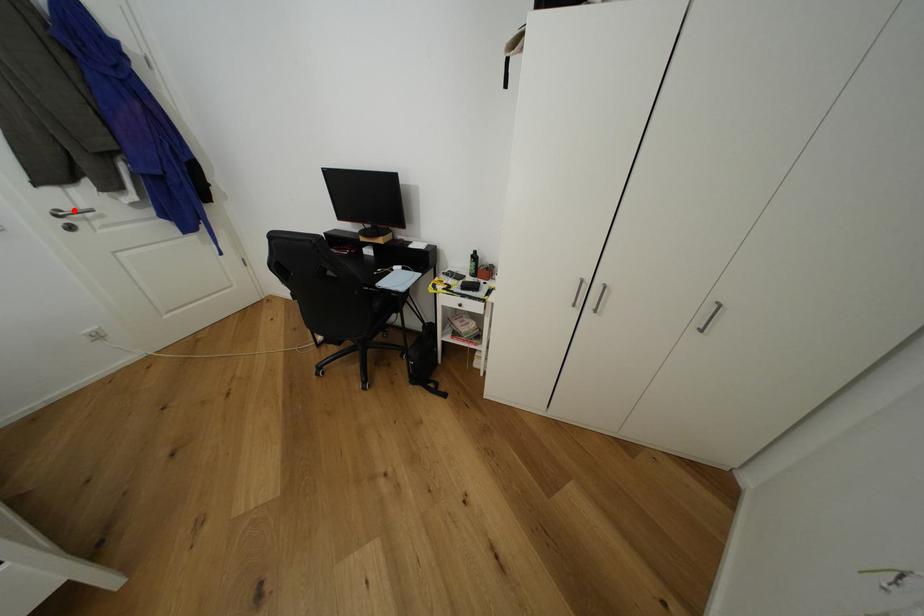
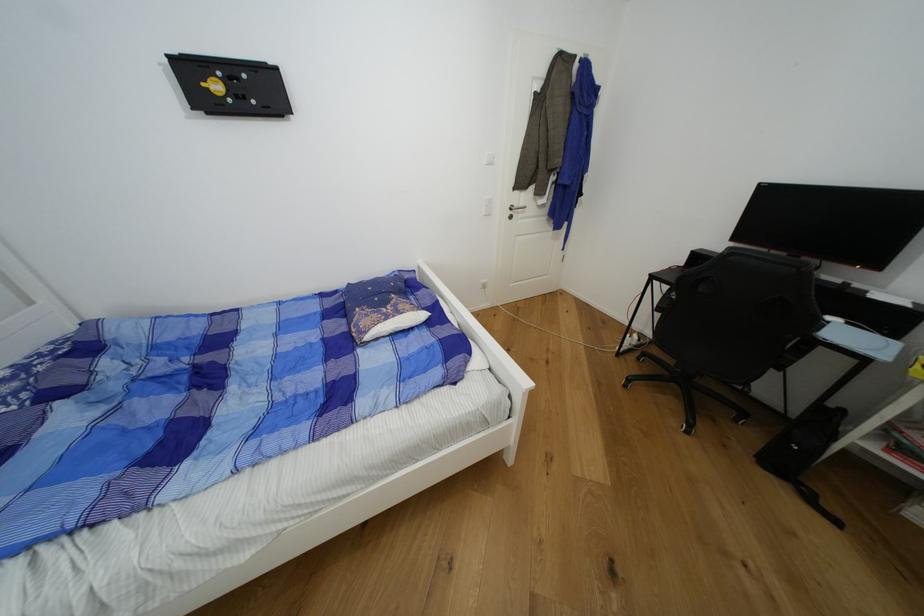
Question: I am providing you with two images of the same scene from different viewpoints. Given a red point in image1, look at the same physical point in image2. Is it:

Choices:
 (A) Closer to the viewpoint
 (B) Farther from the viewpoint

Answer: (A)